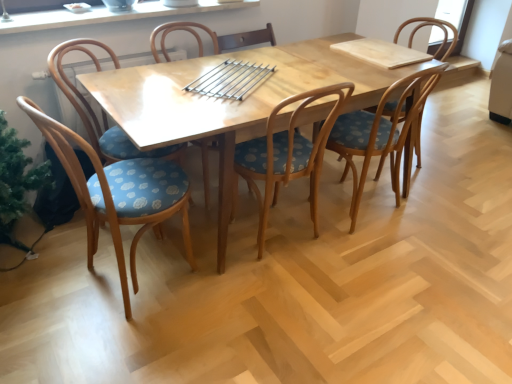
Identify the location of vacant space that is to the left of blue polka dot wood chair at left, which is the 2th chair from left to right. Image resolution: width=512 pixels, height=384 pixels. (51, 284).